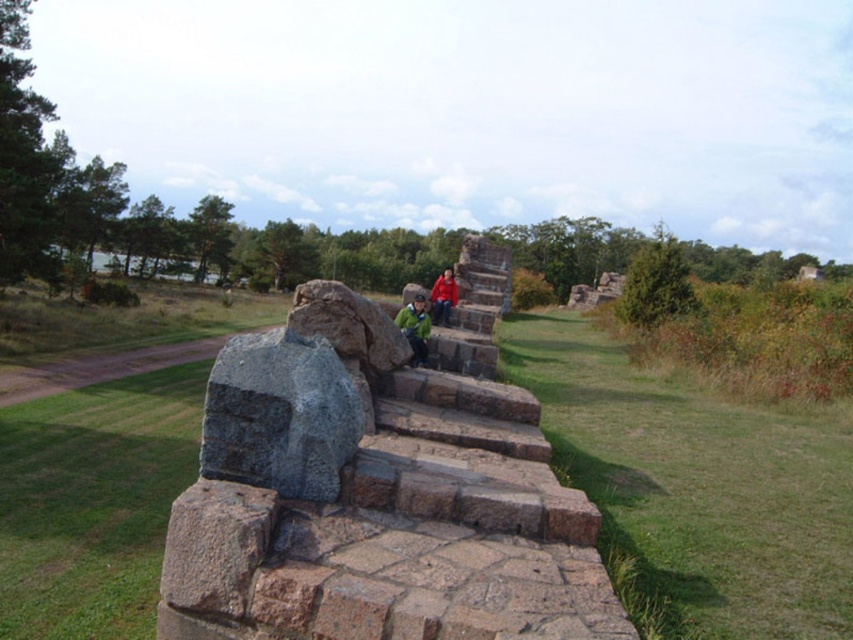
You are a hiker carrying a backpack and need to rest. You see the gray stone steps at center and the red fabric jacket at center. Which object is bigger and can provide a better resting spot?

The gray stone steps at center has a larger size compared to the red fabric jacket at center, so it can provide a better resting spot.

Looking at this image, you are standing at the top of the stone staircase and want to walk down to the lower part. There are two points marked on the staircase. Which point, point (469, 520) or point (399, 316), is closer to you as you start descending?

Point (469, 520) is closer to the viewer than point (399, 316), so it is the closer point as you start descending the staircase.

You are a hiker who wants to know if you can place your backpack between the gray stone steps at center and the green matte jacket at center without it overlapping either. Can you do this?

The gray stone steps at center are wider than the green matte jacket at center. Since the steps are wider, there might be enough space between them to place your backpack without overlapping, but the exact feasibility depends on the backpack size and the actual distance between the objects.